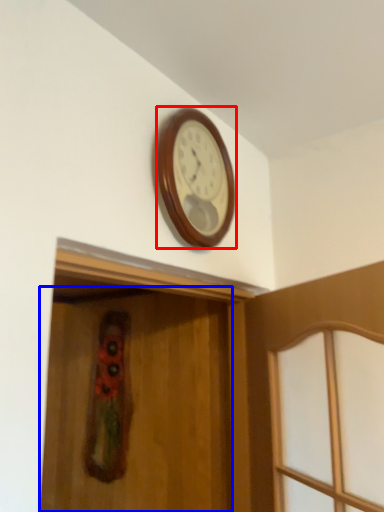
Question: Which point is closer to the camera, wall clock (highlighted by a red box) or screen door (highlighted by a blue box)?

Choices:
 (A) wall clock
 (B) screen door

Answer: (B)